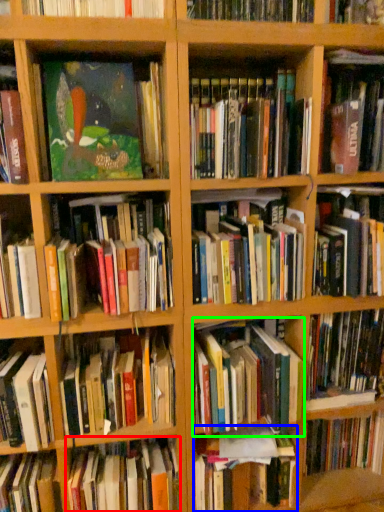
Question: Which object is positioned closest to book (highlighted by a red box)? Select from book (highlighted by a blue box) and book (highlighted by a green box).

Choices:
 (A) book
 (B) book

Answer: (A)